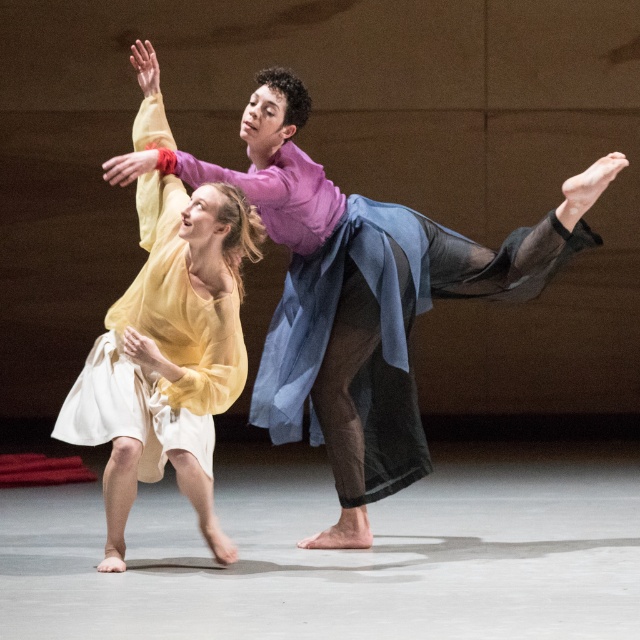
Is point (353, 216) in front of point (230, 300)?

No, (353, 216) is further to viewer.

Is point (323, 243) more distant than point (83, 372)?

That is True.

Which is in front, point (298, 296) or point (176, 198)?

Point (176, 198) is in front.

Locate an element on the screen. The height and width of the screenshot is (640, 640). matte yellow dress at center is located at coordinates (360, 296).